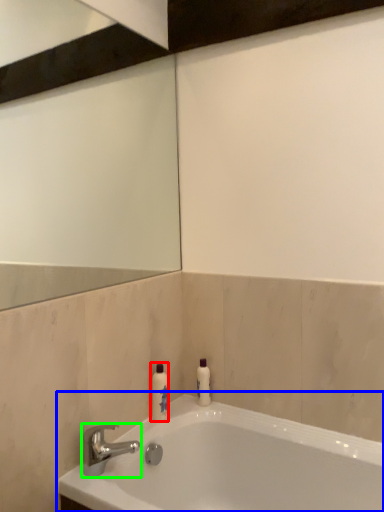
Question: Based on their relative distances, which object is farther from toiletry (highlighted by a red box)? Choose from bathtub (highlighted by a blue box) and tap (highlighted by a green box).

Choices:
 (A) bathtub
 (B) tap

Answer: (A)